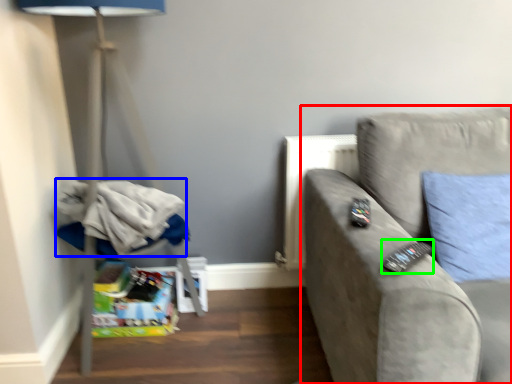
Question: Considering the real-world distances, which object is farthest from studio couch (highlighted by a red box)? laundry (highlighted by a blue box) or remote (highlighted by a green box)?

Choices:
 (A) laundry
 (B) remote

Answer: (A)